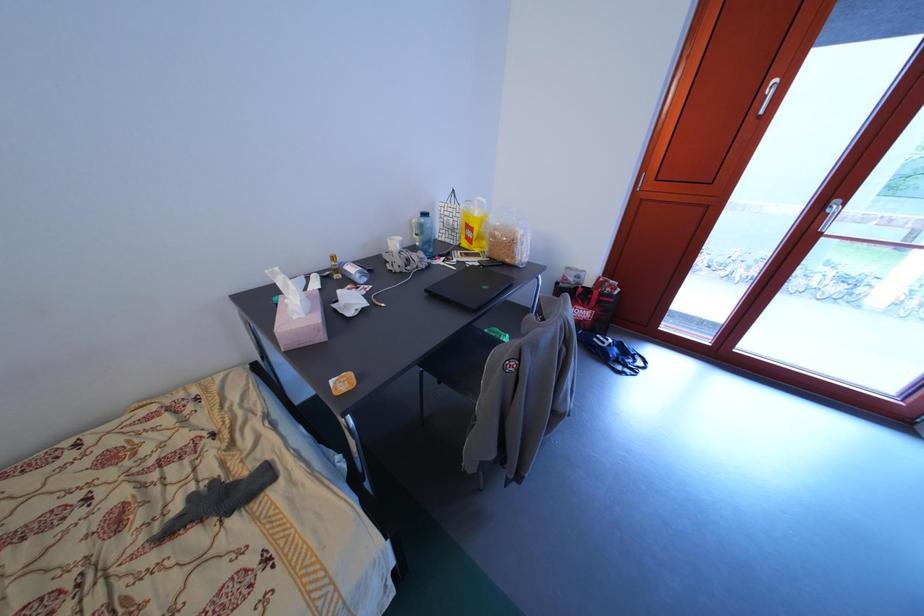
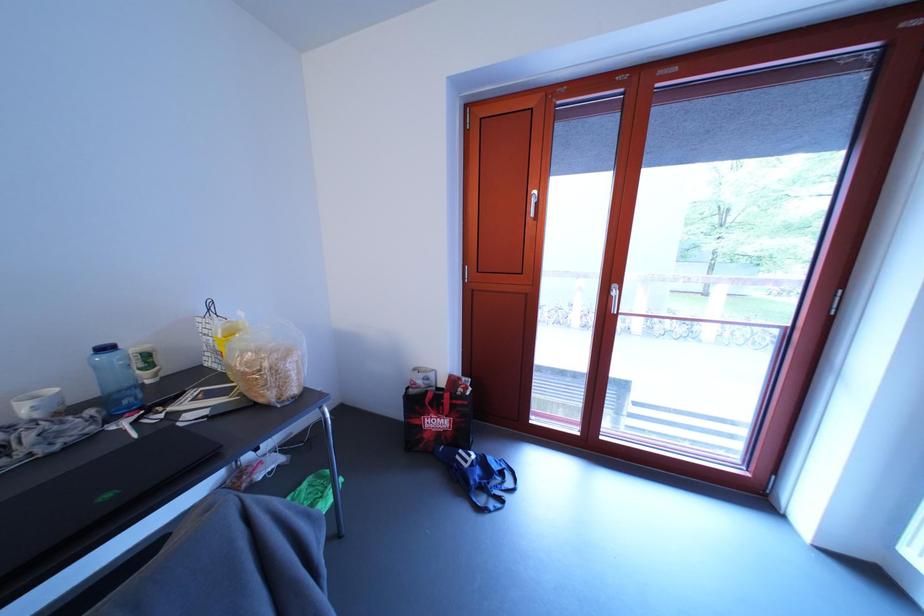
Question: Which direction would the cameraman need to move to produce the second image? Reply with the corresponding letter.

Choices:
 (A) Left
 (B) Right
 (C) Forward
 (D) Backward

Answer: (B)